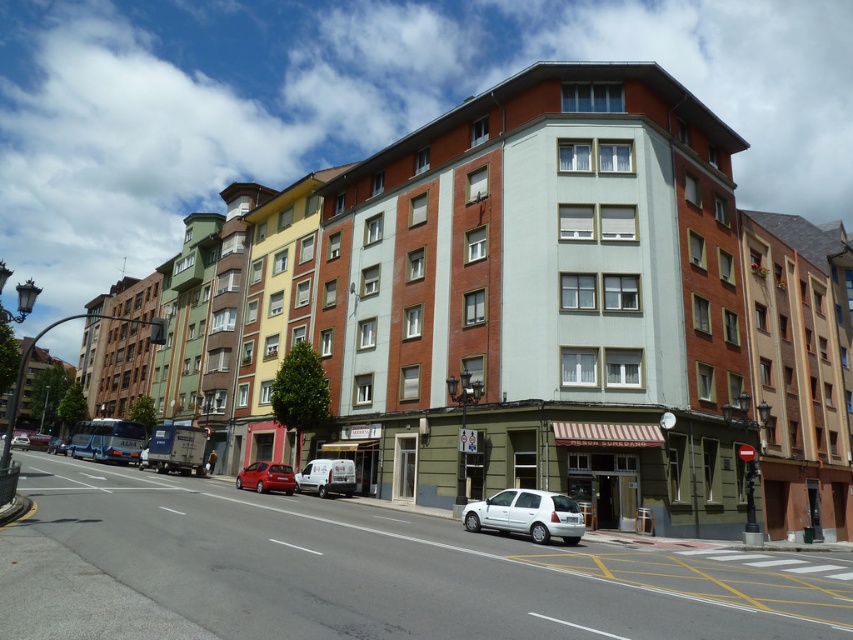
Question: Is white matte van at center smaller than matte black car at center?

Choices:
 (A) yes
 (B) no

Answer: (A)

Question: Among these points, which one is farthest from the camera?

Choices:
 (A) (548, 497)
 (B) (287, 474)

Answer: (B)

Question: Is white matte van at center positioned at the back of metallic silver van at center-left?

Choices:
 (A) no
 (B) yes

Answer: (A)

Question: Which object is farther from the camera taking this photo?

Choices:
 (A) matte black car at center
 (B) white matte van at center
 (C) white matte hatchback at center
 (D) shiny red hatchback at center

Answer: (A)

Question: Can you confirm if white matte van at center is positioned to the right of metallic silver van at center-left?

Choices:
 (A) yes
 (B) no

Answer: (A)

Question: Which object is the farthest from the matte black car at center?

Choices:
 (A) white matte hatchback at center
 (B) metallic silver van at center-left
 (C) shiny red hatchback at center

Answer: (A)